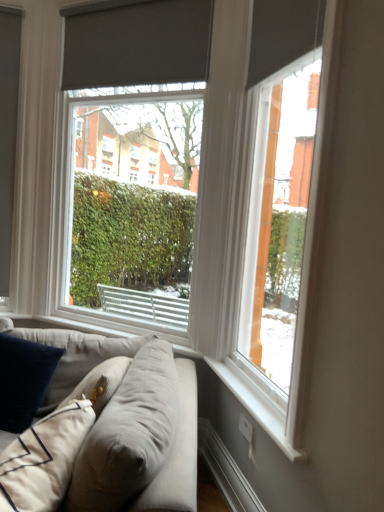
Identify the location of light gray fabric couch at lower left. (108, 430).

This screenshot has width=384, height=512. What do you see at coordinates (134, 155) in the screenshot?
I see `matte gray roller blind at center, the 2th window viewed from the front` at bounding box center [134, 155].

Locate an element on the screen. white painted wood at lower right is located at coordinates [x=257, y=400].

Can you tell me how much matte gray roller blind at center, which is the 1th window in left-to-right order, and matte gray roller blind at right, marked as the 1th window in a front-to-back arrangement, differ in facing direction?

matte gray roller blind at center, which is the 1th window in left-to-right order, and matte gray roller blind at right, marked as the 1th window in a front-to-back arrangement, are facing 47.4 degrees away from each other.

Is matte gray roller blind at center, which is the 1th window in left-to-right order, wider than matte gray roller blind at right, marked as the 1th window in a front-to-back arrangement?

Correct, the width of matte gray roller blind at center, which is the 1th window in left-to-right order, exceeds that of matte gray roller blind at right, marked as the 1th window in a front-to-back arrangement.

Which of these two, matte gray roller blind at center, the 2th window viewed from the front, or matte gray roller blind at right, marked as the 1th window in a front-to-back arrangement, stands shorter?

matte gray roller blind at right, marked as the 1th window in a front-to-back arrangement.

Could you tell me if velvety dark blue pillow at lower left is facing matte gray roller blind at center, the first window from the back?

No, velvety dark blue pillow at lower left is not turned towards matte gray roller blind at center, the first window from the back.

Does velvety dark blue pillow at lower left have a greater width compared to matte gray roller blind at center, the 2th window viewed from the right?

Yes, velvety dark blue pillow at lower left is wider than matte gray roller blind at center, the 2th window viewed from the right.

Is velvety dark blue pillow at lower left not inside matte gray roller blind at center, which is the 1th window in left-to-right order?

Yes, velvety dark blue pillow at lower left is outside of matte gray roller blind at center, which is the 1th window in left-to-right order.

Is white painted wood at lower right wider or thinner than velvety dark blue pillow at lower left?

white painted wood at lower right is thinner than velvety dark blue pillow at lower left.

How different are the orientations of white painted wood at lower right and velvety dark blue pillow at lower left in degrees?

The angular difference between white painted wood at lower right and velvety dark blue pillow at lower left is 65.7 degrees.

Can you confirm if white painted wood at lower right is shorter than velvety dark blue pillow at lower left?

Yes, white painted wood at lower right is shorter than velvety dark blue pillow at lower left.

Would you say white painted wood at lower right is outside velvety dark blue pillow at lower left?

Yes, white painted wood at lower right is located beyond the bounds of velvety dark blue pillow at lower left.

Is white painted wood at lower right completely or partially outside of light gray fabric couch at lower left?

That's correct, white painted wood at lower right is outside of light gray fabric couch at lower left.

Between white painted wood at lower right and light gray fabric couch at lower left, which one appears on the left side from the viewer's perspective?

light gray fabric couch at lower left is more to the left.

In terms of size, does white painted wood at lower right appear bigger or smaller than light gray fabric couch at lower left?

Considering their sizes, white painted wood at lower right takes up less space than light gray fabric couch at lower left.

The width and height of the screenshot is (384, 512). Find the location of `studio couch below the white painted wood at lower right (from the image's perspective)`. studio couch below the white painted wood at lower right (from the image's perspective) is located at coordinates (108, 430).

Is white painted wood at lower right beside matte gray roller blind at center, the first window from the back?

No, white painted wood at lower right is not making contact with matte gray roller blind at center, the first window from the back.

Can you tell me how much white painted wood at lower right and matte gray roller blind at center, the 2th window viewed from the right, differ in facing direction?

There is a 47.3-degree angle between the facing directions of white painted wood at lower right and matte gray roller blind at center, the 2th window viewed from the right.

Considering the relative sizes of white painted wood at lower right and matte gray roller blind at center, the first window from the back, in the image provided, is white painted wood at lower right thinner than matte gray roller blind at center, the first window from the back,?

Yes.

Which of these two, white painted wood at lower right or matte gray roller blind at center, which is the 1th window in left-to-right order, is smaller?

white painted wood at lower right is smaller.

Does light gray fabric couch at lower left have a greater height compared to matte gray roller blind at center, the 2th window viewed from the right?

Incorrect, the height of light gray fabric couch at lower left is not larger of that of matte gray roller blind at center, the 2th window viewed from the right.

Is light gray fabric couch at lower left outside of matte gray roller blind at center, the first window from the back?

Yes, light gray fabric couch at lower left is outside of matte gray roller blind at center, the first window from the back.

Is light gray fabric couch at lower left to the left or to the right of matte gray roller blind at center, the 2th window viewed from the right, in the image?

light gray fabric couch at lower left is to the left of matte gray roller blind at center, the 2th window viewed from the right.

Is point (18, 446) closer or farther from the camera than point (127, 316)?

Point (18, 446) is closer to the camera than point (127, 316).

Considering the sizes of matte gray roller blind at right, marked as the 1th window in a front-to-back arrangement, and light gray fabric couch at lower left in the image, is matte gray roller blind at right, marked as the 1th window in a front-to-back arrangement, bigger or smaller than light gray fabric couch at lower left?

matte gray roller blind at right, marked as the 1th window in a front-to-back arrangement, is smaller than light gray fabric couch at lower left.

Can we say matte gray roller blind at right, marked as the 1th window in a front-to-back arrangement, lies outside light gray fabric couch at lower left?

Yes.

From a real-world perspective, which is physically above, matte gray roller blind at right, marked as the 1th window in a front-to-back arrangement, or light gray fabric couch at lower left?

matte gray roller blind at right, marked as the 1th window in a front-to-back arrangement, from a real-world perspective.

Does point (256, 221) lie in front of point (132, 473)?

No, it is behind (132, 473).

This screenshot has width=384, height=512. I want to click on window on the right of matte gray roller blind at center, which is the 1th window in left-to-right order, so click(x=278, y=226).

This screenshot has width=384, height=512. Identify the location of pillow on the left of matte gray roller blind at center, the 2th window viewed from the front. (23, 380).

Based on their spatial positions, is matte gray roller blind at right, marked as the second window in a back-to-front arrangement, or matte gray roller blind at center, which is the 1th window in left-to-right order, closer to white painted wood at lower right?

matte gray roller blind at right, marked as the second window in a back-to-front arrangement, lies closer to white painted wood at lower right than the other object.

From the picture: Based on their spatial positions, is matte gray roller blind at right, the 2th window viewed from the left, or matte gray roller blind at center, the first window from the back, further from light gray fabric couch at lower left?

matte gray roller blind at center, the first window from the back, is further to light gray fabric couch at lower left.

Based on their spatial positions, is matte gray roller blind at right, marked as the second window in a back-to-front arrangement, or velvety dark blue pillow at lower left further from light gray fabric couch at lower left?

matte gray roller blind at right, marked as the second window in a back-to-front arrangement, is further to light gray fabric couch at lower left.

Consider the image. Based on their spatial positions, is velvety dark blue pillow at lower left or matte gray roller blind at right, the 2th window viewed from the left, further from matte gray roller blind at center, the 2th window viewed from the right?

velvety dark blue pillow at lower left.

From the picture: Looking at the image, which one is located closer to velvety dark blue pillow at lower left, light gray fabric couch at lower left or white painted wood at lower right?

light gray fabric couch at lower left is positioned closer to the anchor velvety dark blue pillow at lower left.

From the image, which object appears to be farther from light gray fabric couch at lower left, matte gray roller blind at center, the 2th window viewed from the front, or velvety dark blue pillow at lower left?

matte gray roller blind at center, the 2th window viewed from the front, lies further to light gray fabric couch at lower left than the other object.

Considering their positions, is light gray fabric couch at lower left positioned closer to velvety dark blue pillow at lower left than matte gray roller blind at right, marked as the first window in a right-to-left arrangement?

Among the two, light gray fabric couch at lower left is located nearer to velvety dark blue pillow at lower left.

Looking at the image, which one is located closer to white painted wood at lower right, velvety dark blue pillow at lower left or matte gray roller blind at right, marked as the second window in a back-to-front arrangement?

matte gray roller blind at right, marked as the second window in a back-to-front arrangement, lies closer to white painted wood at lower right than the other object.

Where is `window between matte gray roller blind at center, the 2th window viewed from the right, and light gray fabric couch at lower left vertically`? This screenshot has height=512, width=384. window between matte gray roller blind at center, the 2th window viewed from the right, and light gray fabric couch at lower left vertically is located at coordinates (278, 226).

What are the coordinates of `window sill between matte gray roller blind at center, the 2th window viewed from the right, and light gray fabric couch at lower left vertically` in the screenshot? It's located at (257, 400).

Locate an element on the screen. This screenshot has height=512, width=384. studio couch between velvety dark blue pillow at lower left and white painted wood at lower right from left to right is located at coordinates (108, 430).

Find the location of a particular element. This screenshot has width=384, height=512. window between matte gray roller blind at center, the 2th window viewed from the right, and white painted wood at lower right, in the vertical direction is located at coordinates (278, 226).